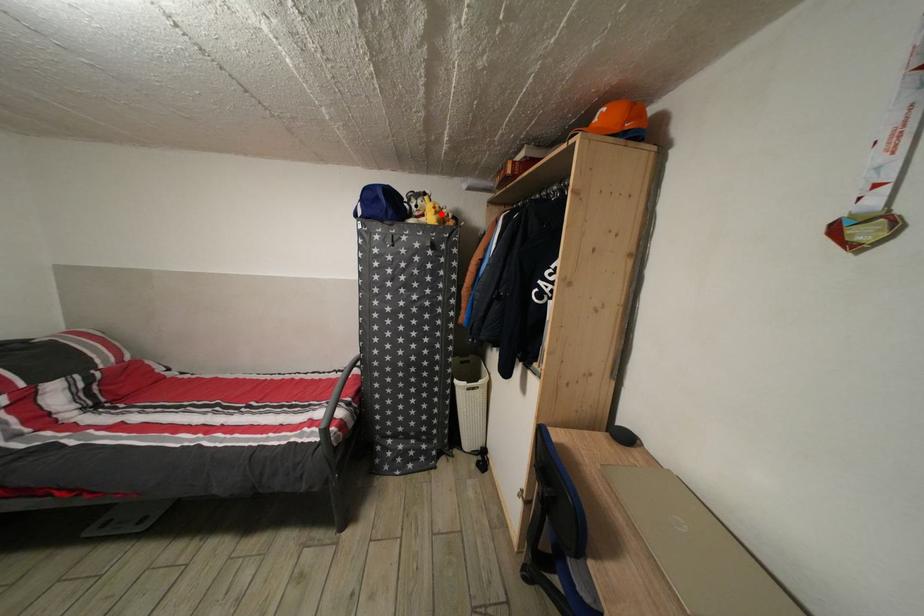
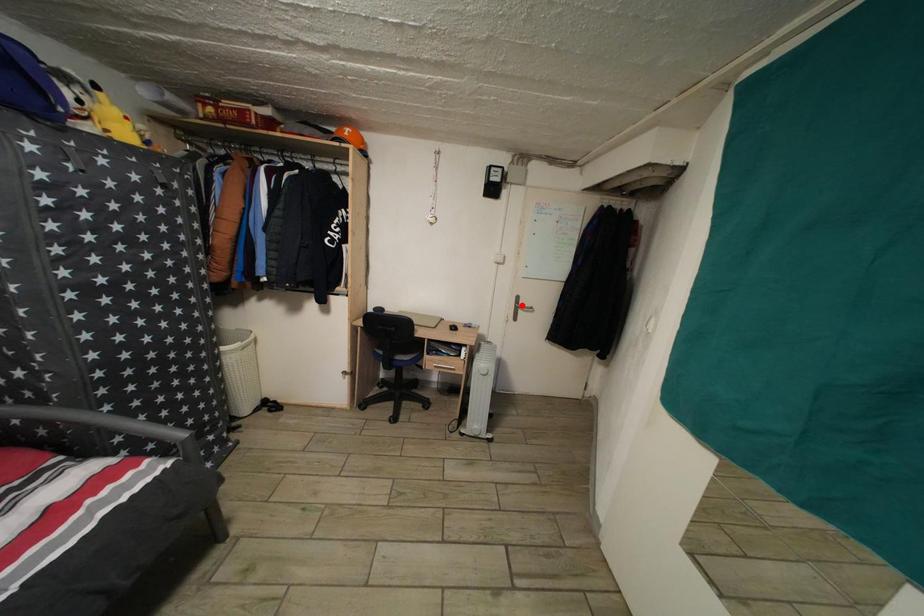
I am providing you with two images of the same scene from different viewpoints. A red point is marked on the first image and another point is marked on the second image. Do the highlighted points in image1 and image2 indicate the same real-world spot?

No